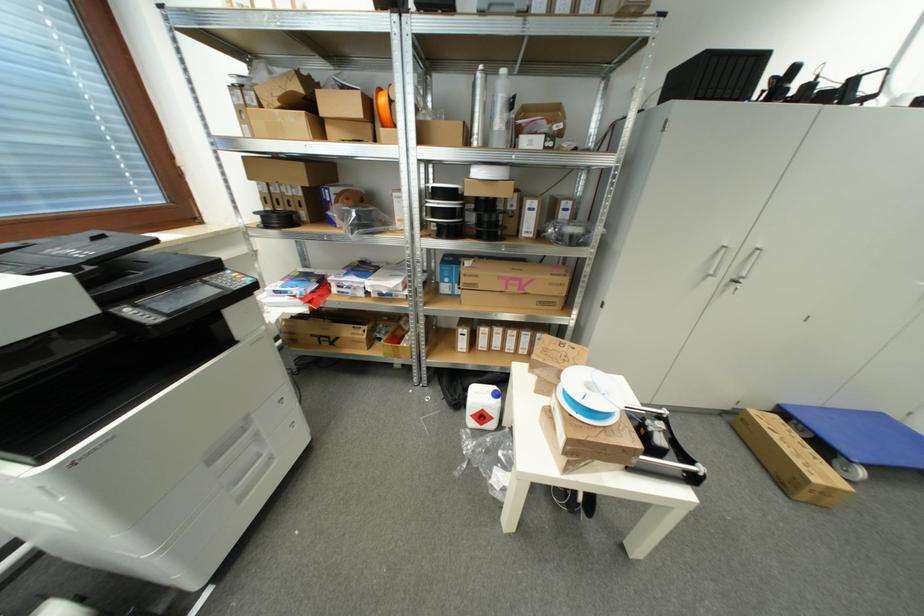
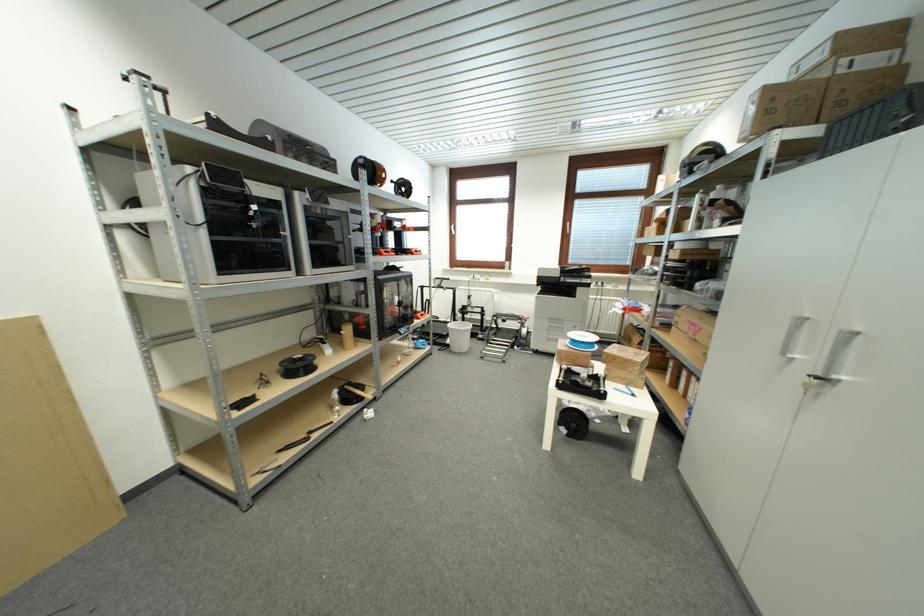
Locate, in the second image, the point that corresponds to (x=517, y=292) in the first image.

(696, 334)